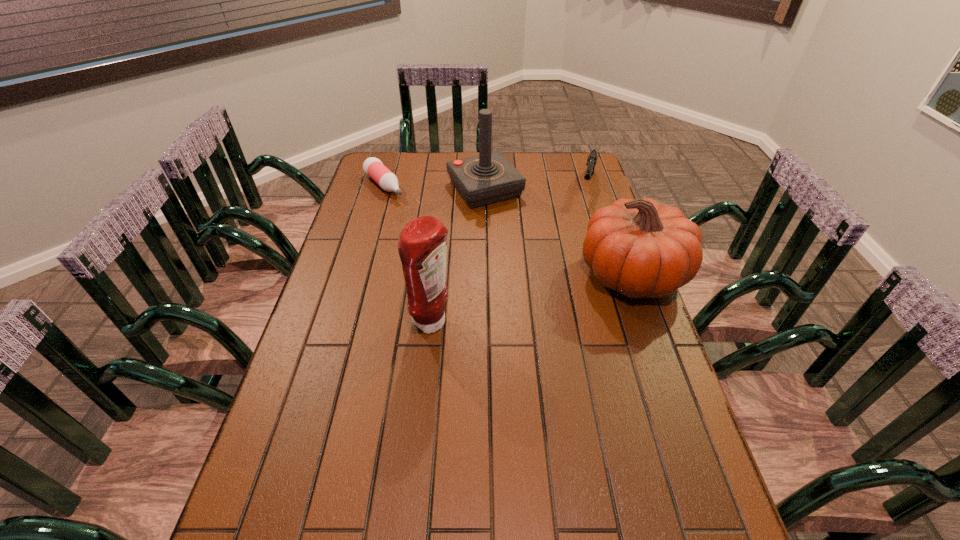
The height and width of the screenshot is (540, 960). Identify the location of vacant region that satisfies the following two spatial constraints: 1. on the front side of the joystick; 2. on the left side of the bottle. (383, 189).

I want to click on free location that satisfies the following two spatial constraints: 1. on the front side of the shortest object; 2. on the face of the pumpkin, so click(x=359, y=274).

At what (x,y) coordinates should I click in order to perform the action: click on vacant region that satisfies the following two spatial constraints: 1. on the front side of the gun; 2. on the face of the pumpkin. Please return your answer as a coordinate pair (x, y). Looking at the image, I should click on (615, 274).